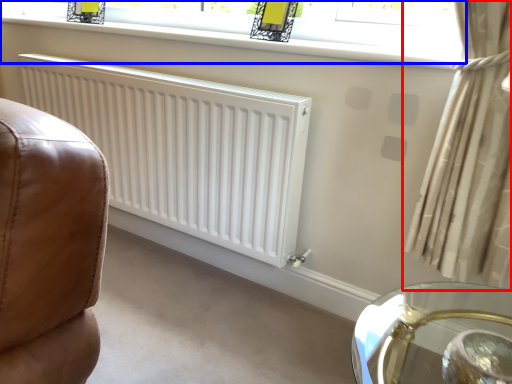
Question: Among these objects, which one is nearest to the camera, curtain (highlighted by a red box) or window (highlighted by a blue box)?

Choices:
 (A) curtain
 (B) window

Answer: (A)